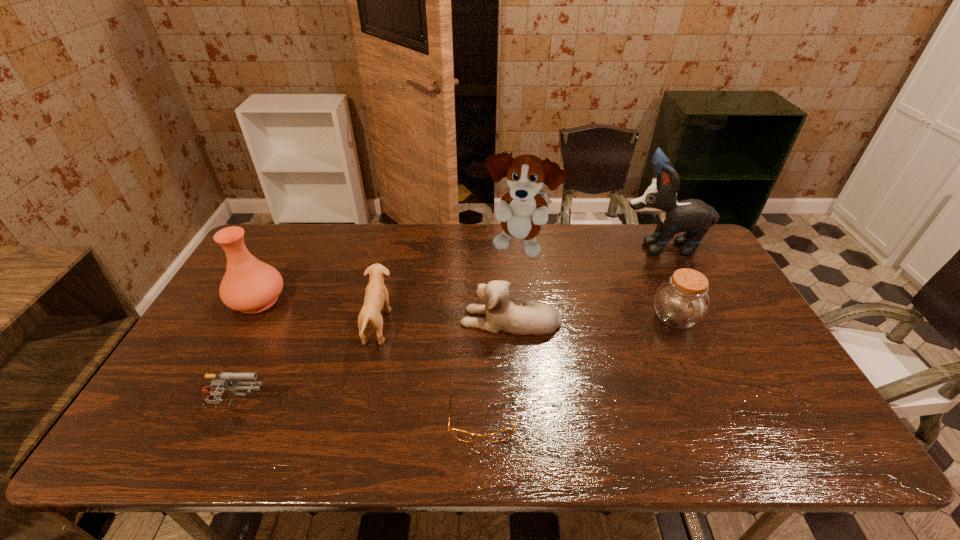
The width and height of the screenshot is (960, 540). Find the location of `object that is positioned at the far right corner`. object that is positioned at the far right corner is located at coordinates (694, 217).

This screenshot has width=960, height=540. I want to click on vacant region at the far edge of the desktop, so click(x=516, y=245).

I want to click on free space at the near edge of the desktop, so click(681, 455).

At what (x,y) coordinates should I click in order to perform the action: click on free spot at the left edge of the desktop. Please return your answer as a coordinate pair (x, y). Looking at the image, I should click on (286, 275).

In the image, there is a desktop. At what (x,y) coordinates should I click in order to perform the action: click on vacant space at the right edge. Please return your answer as a coordinate pair (x, y). The height and width of the screenshot is (540, 960). Looking at the image, I should click on (723, 368).

This screenshot has width=960, height=540. Identify the location of vacant space at the far left corner of the desktop. 298,231.

Image resolution: width=960 pixels, height=540 pixels. In order to click on unoccupied position between the shortest object and the rightmost puppy in this screenshot , I will do `click(571, 333)`.

Locate an element on the screen. This screenshot has height=540, width=960. vacant region between the gun and the third tallest object is located at coordinates (247, 353).

Locate an element on the screen. The height and width of the screenshot is (540, 960). vacant space that is in between the jar and the seventh tallest object is located at coordinates (455, 362).

Where is `object that ranks as the sixth closest to the leftmost puppy`? The height and width of the screenshot is (540, 960). object that ranks as the sixth closest to the leftmost puppy is located at coordinates (681, 302).